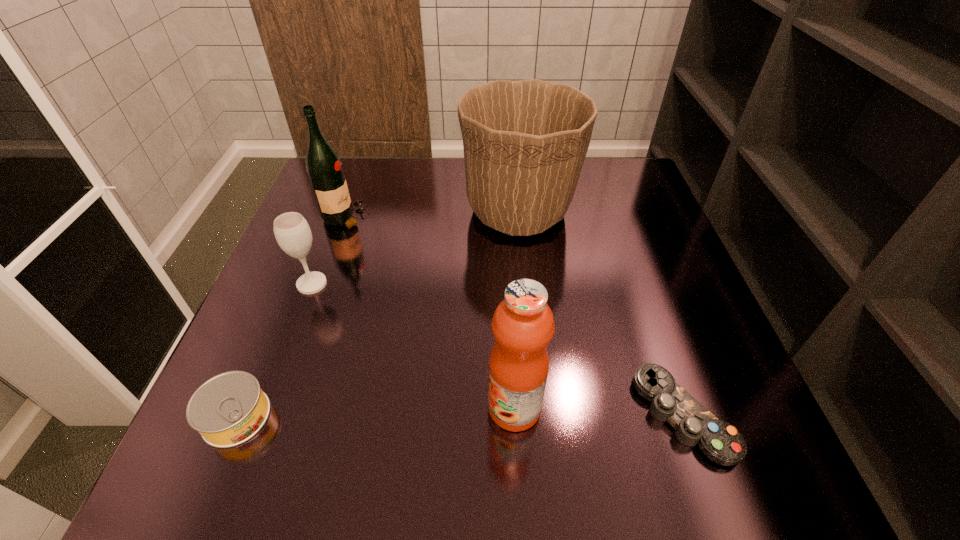
At what (x,y) coordinates should I click in order to perform the action: click on free space at the right edge of the desktop. Please return your answer as a coordinate pair (x, y). The height and width of the screenshot is (540, 960). Looking at the image, I should click on click(679, 373).

The image size is (960, 540). Find the location of `vacant space at the near left corner of the desktop`. vacant space at the near left corner of the desktop is located at coordinates (279, 488).

Locate an element on the screen. The height and width of the screenshot is (540, 960). free space at the far right corner of the desktop is located at coordinates [632, 178].

This screenshot has height=540, width=960. In order to click on vacant region between the fifth tallest object and the flowerpot in this screenshot , I will do `click(377, 314)`.

The height and width of the screenshot is (540, 960). Identify the location of vacant point located between the can and the third farthest object. (275, 350).

Identify the location of vacant area that lies between the wine bottle and the fifth tallest object. The height and width of the screenshot is (540, 960). (291, 317).

The height and width of the screenshot is (540, 960). I want to click on unoccupied position between the second shortest object and the fruit juice, so click(x=375, y=412).

Where is `free space between the wine bottle and the flowerpot`? The image size is (960, 540). free space between the wine bottle and the flowerpot is located at coordinates (432, 214).

You are a GUI agent. You are given a task and a screenshot of the screen. Output one action in this format:
    pyautogui.click(x=<x>, y=<y>)
    Task: Click on the vacant space that's between the control and the second shortest object
    This screenshot has width=960, height=540.
    Given the screenshot: What is the action you would take?
    pyautogui.click(x=460, y=416)

The image size is (960, 540). What are the coordinates of `object that is the closest to the wine bottle` in the screenshot? It's located at (292, 232).